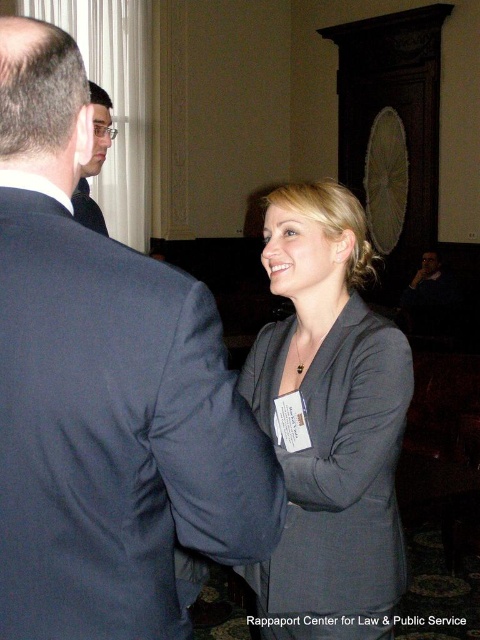
You are standing at the point with coordinates point (100, 106) and want to walk to the point (351, 451). According to the scene description, which direction should you move to reach your destination?

You should move forward because point (351, 451) is in front of point (100, 106).

Where is the dark blue suit at center located in the image?

The dark blue suit at center is located at point 0.613 on the x axis and 0.219 on the y axis.

You are standing at the origin point in the image. Where is the dark blue suit at center located in terms of coordinates?

The dark blue suit at center is located at coordinates point [105,392].